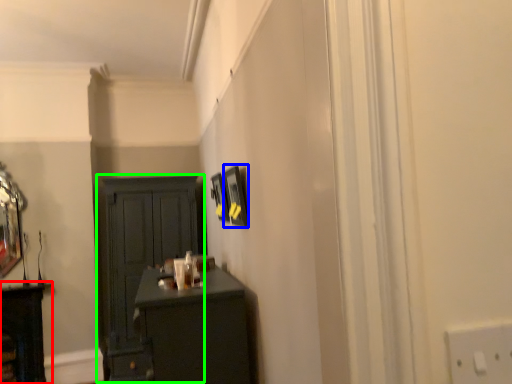
Question: Which is farther away from cabinetry (highlighted by a red box)? picture frame (highlighted by a blue box) or cupboard (highlighted by a green box)?

Choices:
 (A) picture frame
 (B) cupboard

Answer: (A)